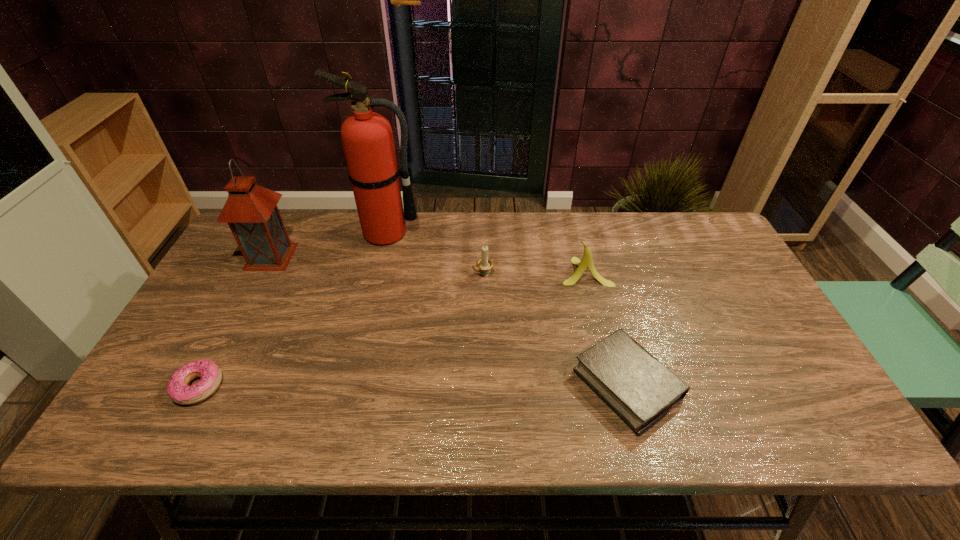
Where is `fire extinguisher`? Image resolution: width=960 pixels, height=540 pixels. fire extinguisher is located at coordinates (367, 138).

The height and width of the screenshot is (540, 960). I want to click on the tallest object, so click(367, 138).

You are a GUI agent. You are given a task and a screenshot of the screen. Output one action in this format:
    pyautogui.click(x=<x>, y=<y>)
    Task: Click on the second tallest object
    This screenshot has height=540, width=960.
    Given the screenshot: What is the action you would take?
    [x=251, y=211]

This screenshot has height=540, width=960. What are the coordinates of `banana` in the screenshot? It's located at click(x=587, y=262).

At what (x,y) coordinates should I click in order to perform the action: click on candle_holder. Please return your answer as a coordinate pair (x, y). Image resolution: width=960 pixels, height=540 pixels. Looking at the image, I should click on (484, 264).

Locate an element on the screen. This screenshot has width=960, height=540. the fifth tallest object is located at coordinates (641, 390).

Identify the location of doughnut. The height and width of the screenshot is (540, 960). (177, 388).

Find the location of a particular element. This screenshot has height=540, width=960. free space located at the nozzle of the fire extinguisher is located at coordinates (368, 314).

Find the location of `vacant space located on the right of the lantern`. vacant space located on the right of the lantern is located at coordinates (357, 256).

Where is `vacant space positioned 0.060m on the right of the banana`? The width and height of the screenshot is (960, 540). vacant space positioned 0.060m on the right of the banana is located at coordinates (631, 272).